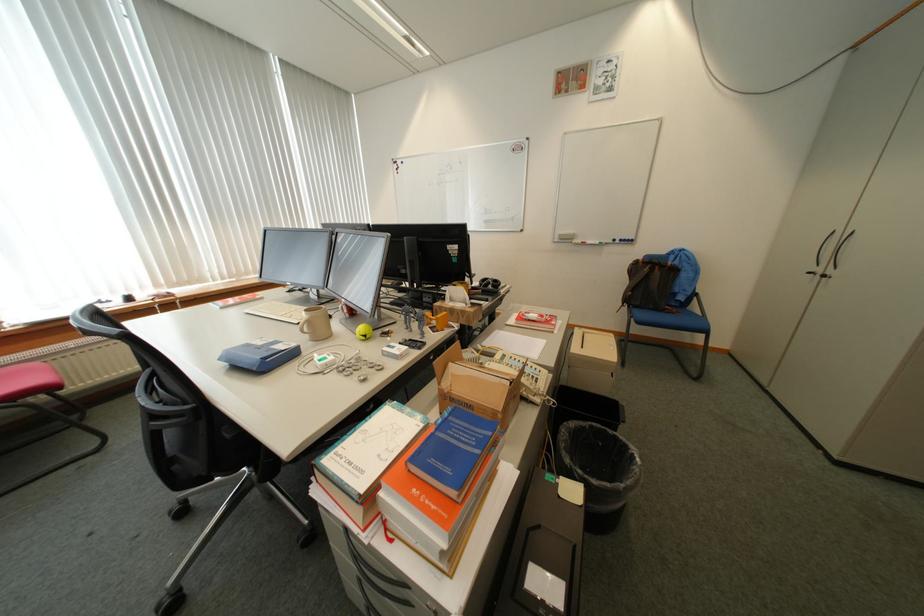
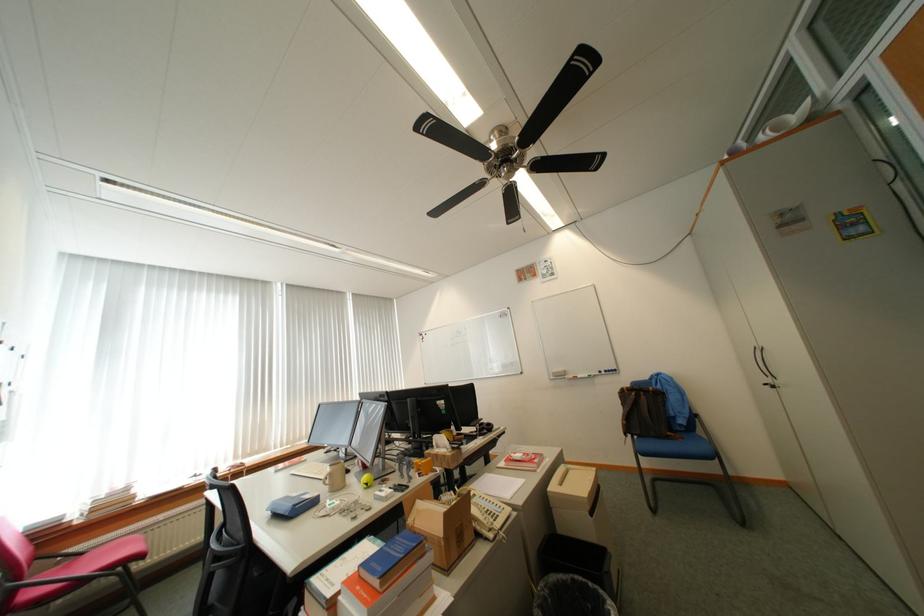
Where in the second image is the point corresponding to (314,330) from the first image?

(336, 482)